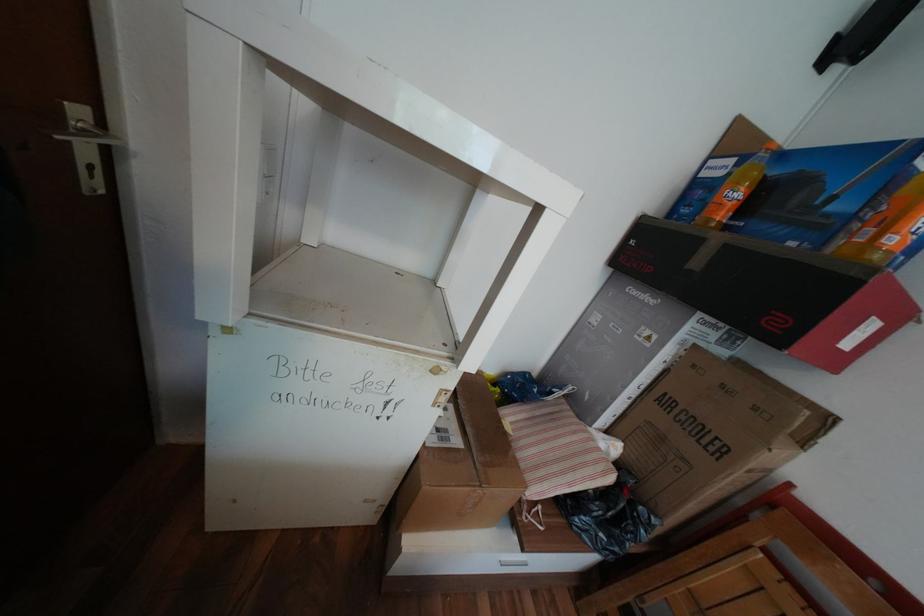
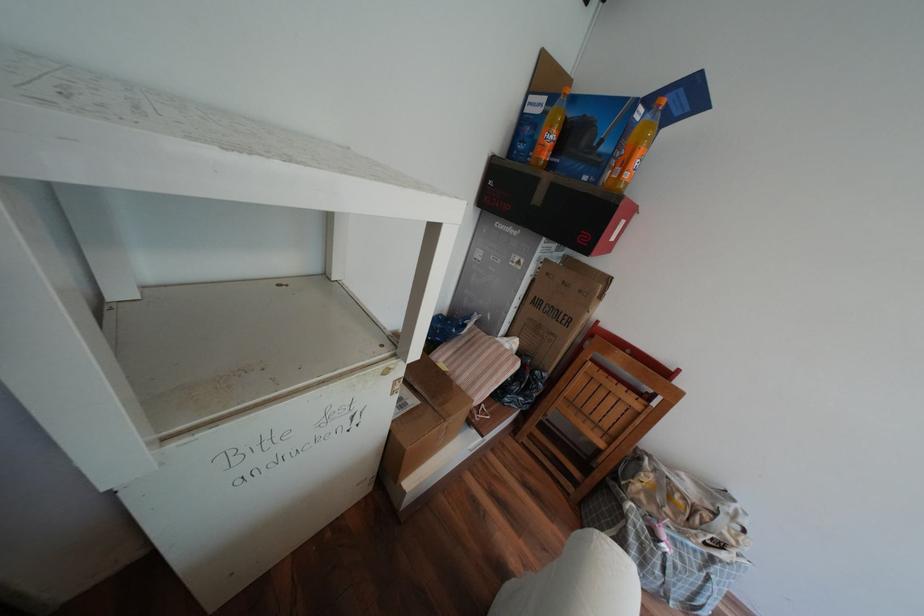
In the second image, find the point that corresponds to point 862,217 in the first image.

(621, 156)